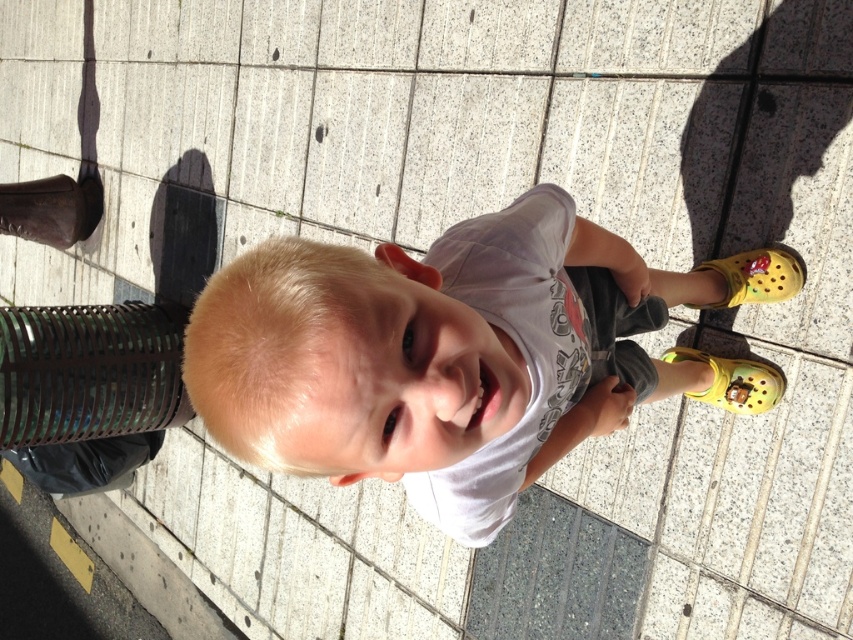
Question: Which point is farther from the camera taking this photo?

Choices:
 (A) (726, 282)
 (B) (550, 332)
 (C) (741, 381)
 (D) (27, 232)

Answer: (D)

Question: Is white cotton shirt at center to the left of yellow croc at lower right from the viewer's perspective?

Choices:
 (A) yes
 (B) no

Answer: (A)

Question: Is white cotton shirt at center closer to camera compared to brown leather boot at left?

Choices:
 (A) yes
 (B) no

Answer: (A)

Question: Among these points, which one is farthest from the camera?

Choices:
 (A) (36, 218)
 (B) (706, 392)
 (C) (788, 284)
 (D) (569, 397)

Answer: (A)

Question: Which of the following is the farthest from the observer?

Choices:
 (A) white cotton shirt at center
 (B) yellow croc at lower right
 (C) yellow croc shoe at lower right
 (D) brown leather boot at left

Answer: (D)

Question: Considering the relative positions of brown leather boot at left and yellow croc at lower right in the image provided, where is brown leather boot at left located with respect to yellow croc at lower right?

Choices:
 (A) above
 (B) below

Answer: (A)